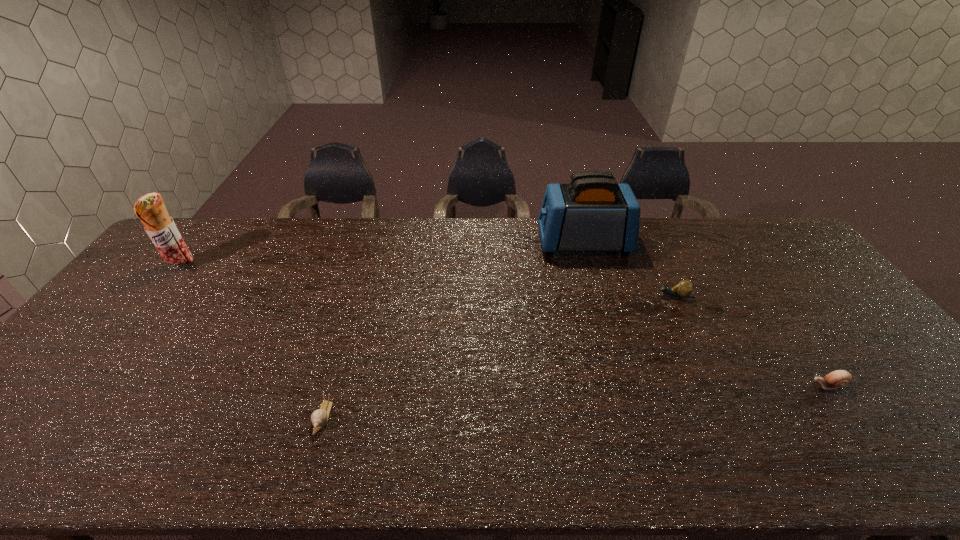
Find the location of a particular element. This screenshot has width=960, height=540. vacant position located on the front-facing side of the toaster is located at coordinates (504, 243).

Where is `vacant region located 0.400m on the front of the burrito`? vacant region located 0.400m on the front of the burrito is located at coordinates (93, 379).

Identify the location of vacant space located 0.260m on the front-facing side of the farthest escargot. (568, 296).

You are a GUI agent. You are given a task and a screenshot of the screen. Output one action in this format:
    pyautogui.click(x=<x>, y=<y>)
    Task: Click on the vacant space located on the front-facing side of the farthest escargot
    
    Given the screenshot: What is the action you would take?
    pyautogui.click(x=625, y=296)

Locate an element on the screen. The width and height of the screenshot is (960, 540). vacant area located 0.400m on the front-facing side of the farthest escargot is located at coordinates (522, 296).

The height and width of the screenshot is (540, 960). I want to click on vacant space located 0.270m on the front-facing side of the fourth farthest object, so click(x=701, y=385).

The width and height of the screenshot is (960, 540). Find the location of `vacant region located 0.390m on the front-facing side of the fourth farthest object`. vacant region located 0.390m on the front-facing side of the fourth farthest object is located at coordinates (652, 385).

Image resolution: width=960 pixels, height=540 pixels. Find the location of `vacant space located on the front-facing side of the fourth farthest object`. vacant space located on the front-facing side of the fourth farthest object is located at coordinates (789, 385).

Locate an element on the screen. This screenshot has height=540, width=960. vacant point located 0.080m on the shell of the shortest escargot is located at coordinates (307, 470).

Locate an element on the screen. object positioned at the far edge is located at coordinates (593, 213).